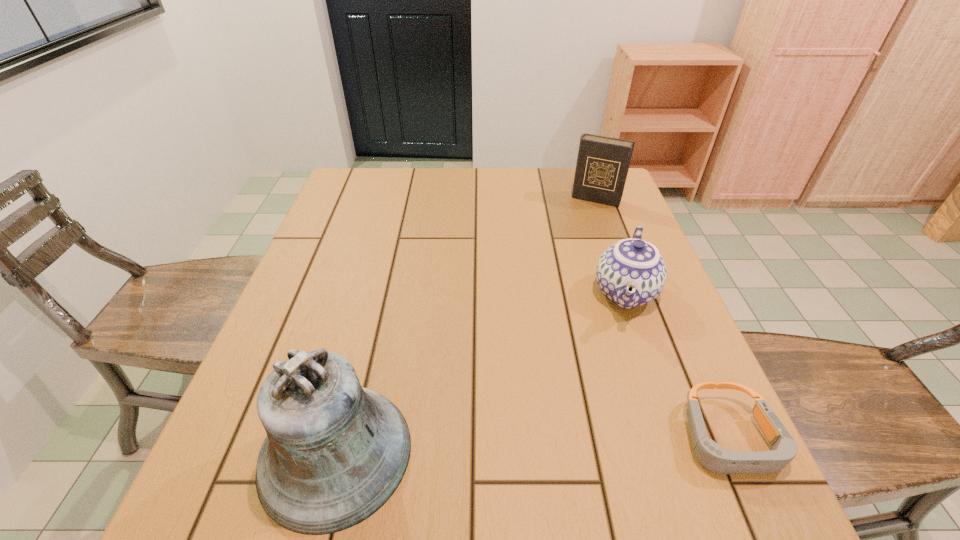
Where is `bell`? The width and height of the screenshot is (960, 540). bell is located at coordinates (335, 452).

You are a GUI agent. You are given a task and a screenshot of the screen. Output one action in this format:
    pyautogui.click(x=<x>, y=<y>)
    Task: Click on the tallest object
    
    Given the screenshot: What is the action you would take?
    pyautogui.click(x=335, y=452)

This screenshot has width=960, height=540. In order to click on the shortest object in this screenshot , I will do `click(712, 456)`.

The width and height of the screenshot is (960, 540). What are the coordinates of `chinaware` in the screenshot? It's located at (630, 273).

Where is `the second farthest object`? Image resolution: width=960 pixels, height=540 pixels. the second farthest object is located at coordinates (630, 273).

Find the location of a particular element. Image resolution: width=960 pixels, height=540 pixels. diary is located at coordinates (602, 166).

Find the location of `the third shortest object`. the third shortest object is located at coordinates (602, 166).

This screenshot has height=540, width=960. Identify the location of vacant point located 0.370m on the right of the tallest object. (629, 453).

Where is `blank space located from the spout of the chinaware`? This screenshot has height=540, width=960. blank space located from the spout of the chinaware is located at coordinates (612, 390).

Locate an element on the screen. This screenshot has height=540, width=960. vacant space located from the spout of the chinaware is located at coordinates (621, 344).